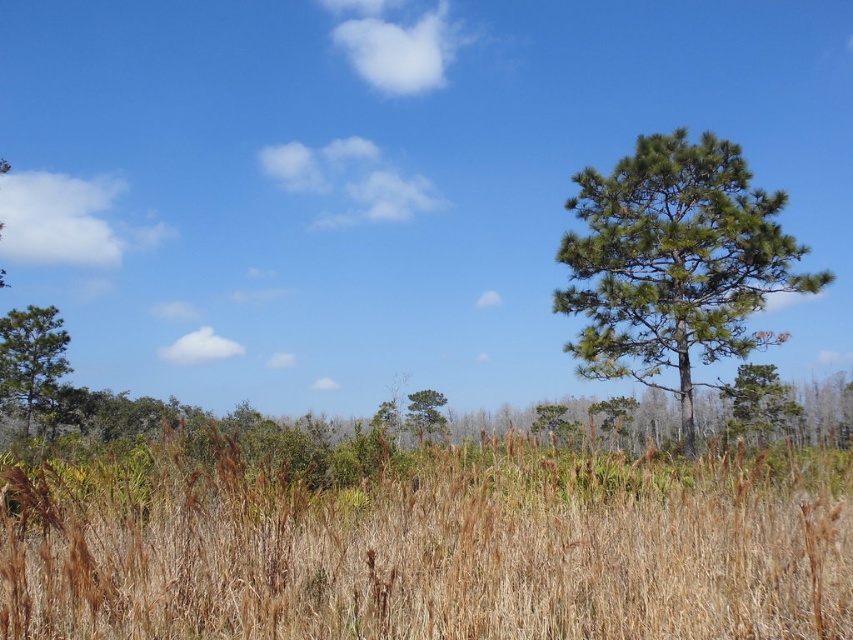
You are standing in the field of golden grass and want to walk towards the green textured pine tree at left and the green matte tree at center. Which tree should you head towards if you want to reach the one closer to your right side?

You should head towards the green matte tree at center because the green textured pine tree at left is to the left of it, so the green matte tree at center is closer to your right side.